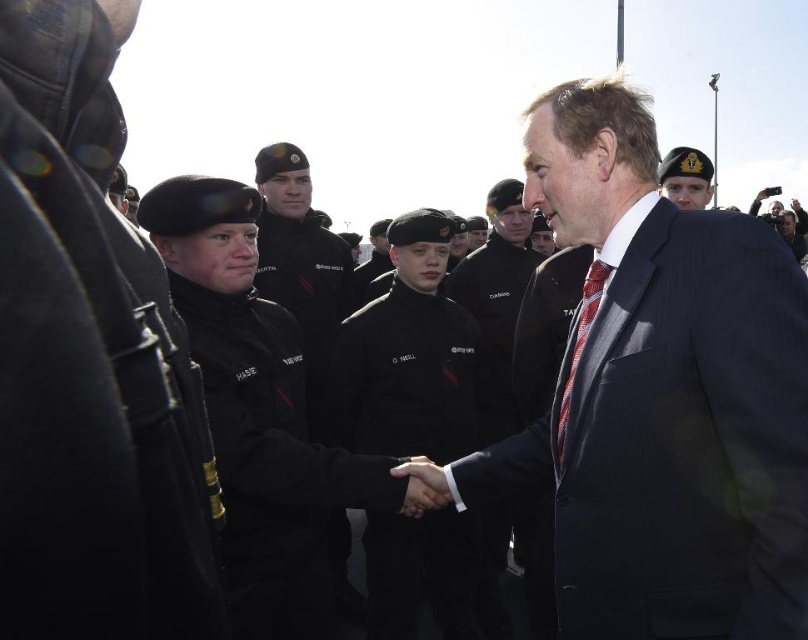
You are standing at the origin point of the coordinate system in the image. The black matte uniform at center is located at point (262,417). Which direction should you move to reach the black matte uniform at center?

The black matte uniform at center is located at coordinates 0.653 in the x direction and 0.325 in the y direction. Since you are at the origin, you should move in the positive x and positive y direction to reach it.

You are a photographer at the event and need to capture a photo where both the black matte uniform at center and the red striped tie at right are clearly visible. Based on their positions, which object is lower in the frame?

The black matte uniform at center is positioned under the red striped tie at right, so the black matte uniform at center is lower in the frame.